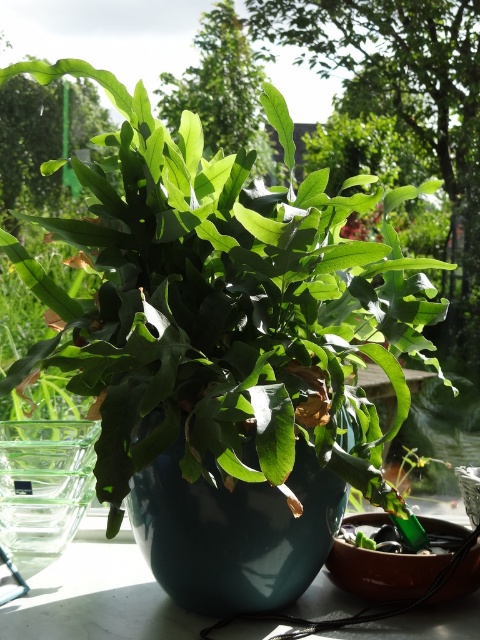
The width and height of the screenshot is (480, 640). What are the coordinates of `white marble table at center` in the screenshot? It's located at (96, 600).

Looking at this image, is white marble table at center shorter than transparent glass vase at left?

Indeed, white marble table at center has a lesser height compared to transparent glass vase at left.

Between point (470, 612) and point (39, 554), which one is positioned in front?

Point (470, 612)

Where is `white marble table at center`? white marble table at center is located at coordinates (96, 600).

Can you confirm if matte blue vase at center is thinner than white marble table at center?

Correct, matte blue vase at center's width is less than white marble table at center's.

Is matte blue vase at center above white marble table at center?

Indeed, matte blue vase at center is positioned over white marble table at center.

Image resolution: width=480 pixels, height=640 pixels. Find the location of `matte blue vase at center`. matte blue vase at center is located at coordinates (233, 532).

Is matte green leafy plant at center positioned behind white marble table at center?

No, it is not.

Is matte green leafy plant at center in front of white marble table at center?

Yes, matte green leafy plant at center is closer to the viewer.

Who is more distant from viewer, [158,337] or [88,632]?

Point [88,632]

Where is `matte green leafy plant at center`? matte green leafy plant at center is located at coordinates (225, 307).